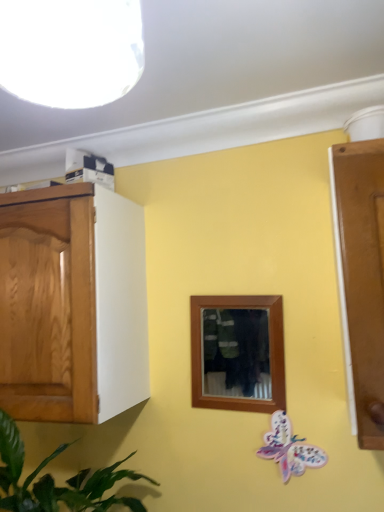
Question: Considering the relative sizes of white glossy light fixture at upper left and green leafy plant at left in the image provided, is white glossy light fixture at upper left thinner than green leafy plant at left?

Choices:
 (A) no
 (B) yes

Answer: (B)

Question: Can you confirm if white glossy light fixture at upper left is wider than green leafy plant at left?

Choices:
 (A) yes
 (B) no

Answer: (B)

Question: Is white glossy light fixture at upper left at the left side of green leafy plant at left?

Choices:
 (A) no
 (B) yes

Answer: (A)

Question: Can you confirm if white glossy light fixture at upper left is taller than green leafy plant at left?

Choices:
 (A) no
 (B) yes

Answer: (A)

Question: Is white glossy light fixture at upper left positioned before green leafy plant at left?

Choices:
 (A) yes
 (B) no

Answer: (A)

Question: Looking at their shapes, would you say pastel paper butterfly at lower right is wider or thinner than green leafy plant at left?

Choices:
 (A) thin
 (B) wide

Answer: (A)

Question: From a real-world perspective, is pastel paper butterfly at lower right physically located above or below green leafy plant at left?

Choices:
 (A) above
 (B) below

Answer: (A)

Question: Is point [x=302, y=461] positioned closer to the camera than point [x=120, y=475]?

Choices:
 (A) farther
 (B) closer

Answer: (A)

Question: Would you say pastel paper butterfly at lower right is to the left or to the right of green leafy plant at left in the picture?

Choices:
 (A) right
 (B) left

Answer: (A)

Question: Is point (46, 66) closer or farther from the camera than point (306, 454)?

Choices:
 (A) farther
 (B) closer

Answer: (B)

Question: From a real-world perspective, relative to pastel paper butterfly at lower right, is white glossy light fixture at upper left vertically above or below?

Choices:
 (A) below
 (B) above

Answer: (B)

Question: Is white glossy light fixture at upper left situated inside pastel paper butterfly at lower right or outside?

Choices:
 (A) inside
 (B) outside

Answer: (B)

Question: Considering the positions of white glossy light fixture at upper left and pastel paper butterfly at lower right in the image, is white glossy light fixture at upper left wider or thinner than pastel paper butterfly at lower right?

Choices:
 (A) thin
 (B) wide

Answer: (B)

Question: From a real-world perspective, relative to green leafy plant at left, is white glossy light fixture at upper left vertically above or below?

Choices:
 (A) above
 (B) below

Answer: (A)

Question: Based on their positions, is white glossy light fixture at upper left located to the left or right of green leafy plant at left?

Choices:
 (A) right
 (B) left

Answer: (A)